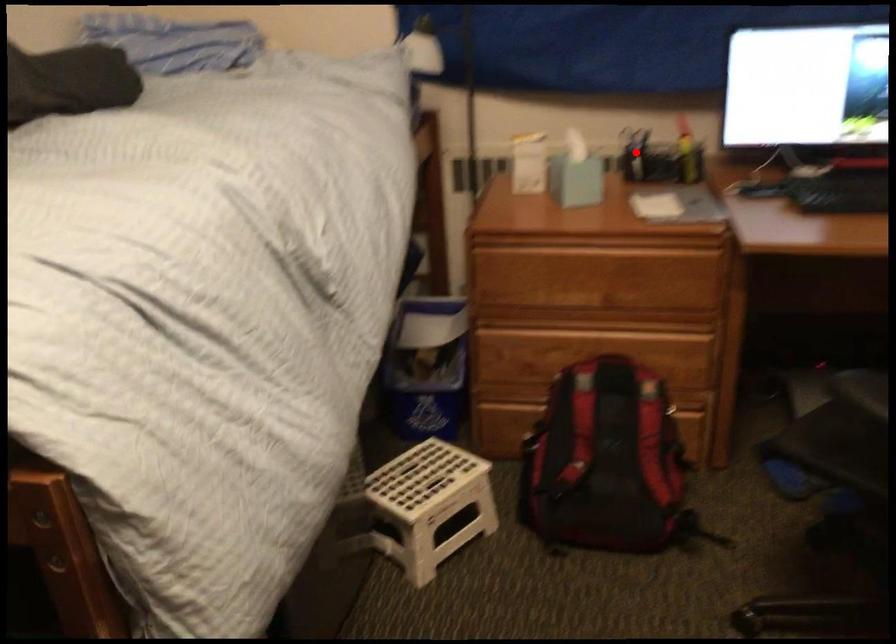
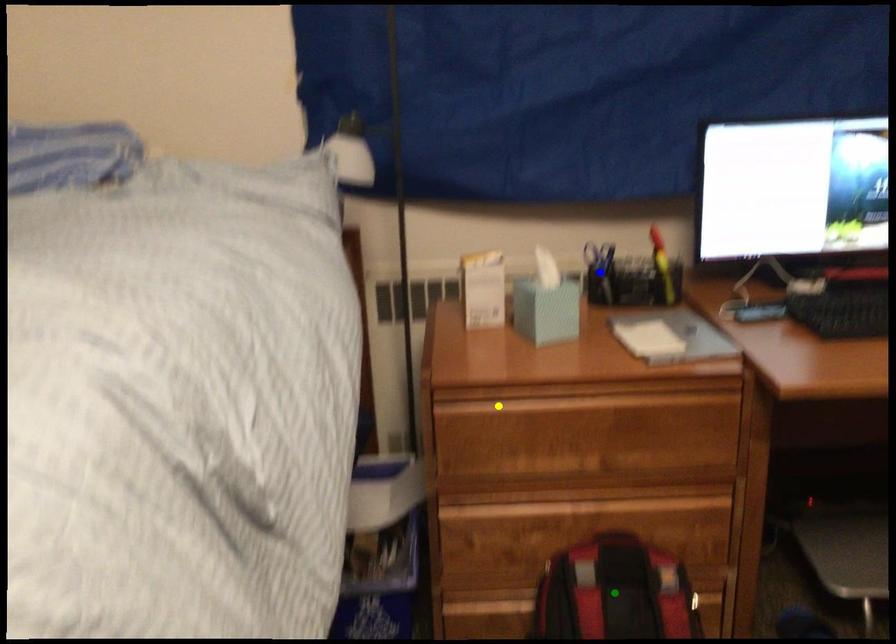
Question: I am providing you with two images of the same scene from different viewpoints. A red point is marked on the first image. You are given multiple points on the second image. In image 2, which mark is for the same physical point as the one in image 1?

Choices:
 (A) blue point
 (B) green point
 (C) yellow point

Answer: (A)